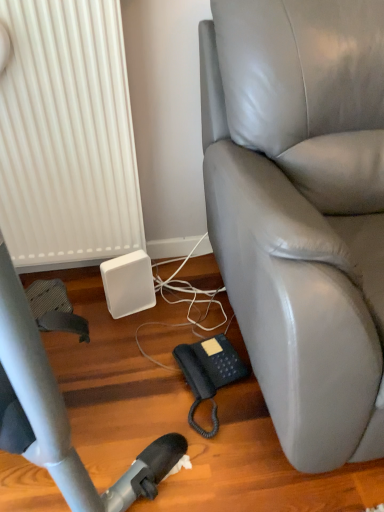
In order to click on vacant area on the back side of black rubberized phone at lower center in this screenshot , I will do click(x=186, y=324).